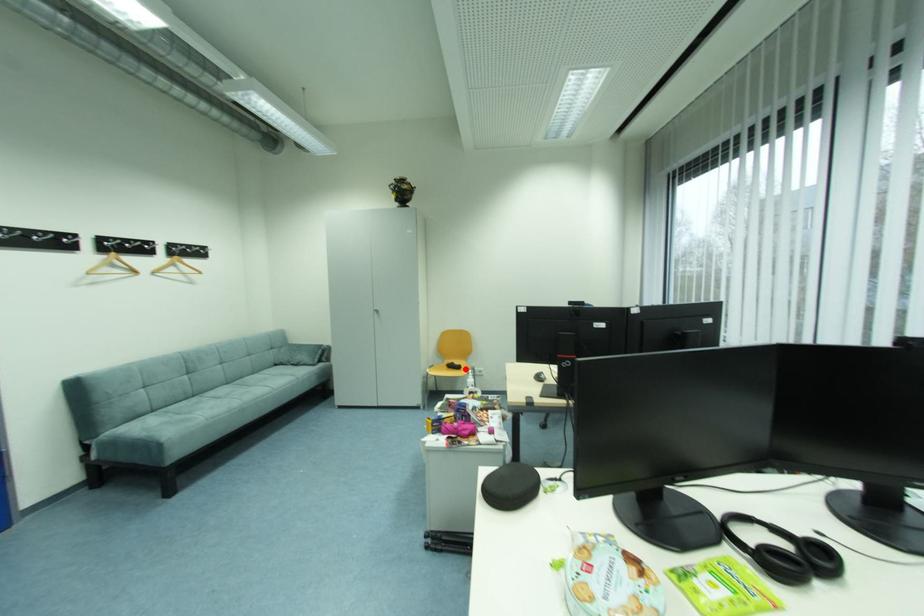
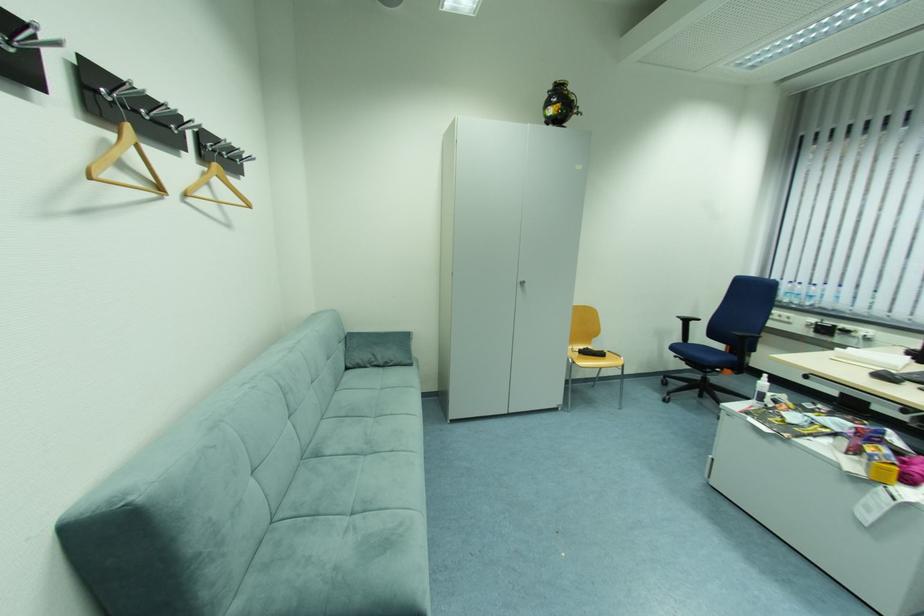
Find the pixel in the second image that matches the highlighted location in the first image.

(608, 355)